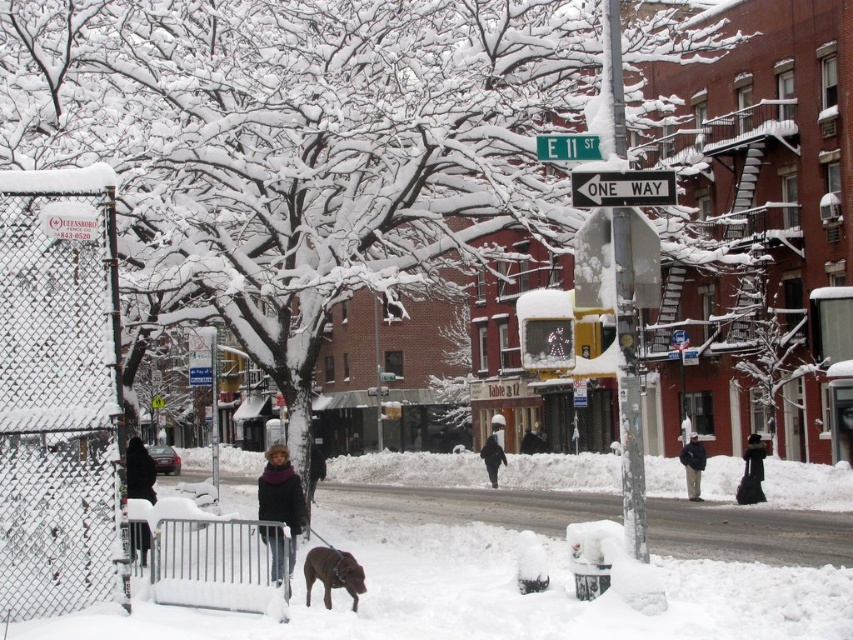
From the picture: Does dark brown leather jacket at center appear over black wool coat at center?

Yes.

Image resolution: width=853 pixels, height=640 pixels. Describe the element at coordinates (281, 497) in the screenshot. I see `dark brown leather jacket at center` at that location.

The image size is (853, 640). In order to click on dark brown leather jacket at center in this screenshot , I will do `click(281, 497)`.

You are a GUI agent. You are given a task and a screenshot of the screen. Output one action in this format:
    pyautogui.click(x=<x>, y=<y>)
    Task: Click on the dark brown leather jacket at center
    Image resolution: width=853 pixels, height=640 pixels.
    Given the screenshot: What is the action you would take?
    pyautogui.click(x=281, y=497)

Is the position of green metallic street sign at upper center less distant than that of black wool coat at center?

Yes, green metallic street sign at upper center is closer to the viewer.

Where is `green metallic street sign at upper center`? Image resolution: width=853 pixels, height=640 pixels. green metallic street sign at upper center is located at coordinates (567, 147).

Which is in front, point (566, 141) or point (498, 417)?

Point (566, 141) is in front.

Where is `green metallic street sign at upper center`? The width and height of the screenshot is (853, 640). green metallic street sign at upper center is located at coordinates (567, 147).

Can you confirm if white chain-link fence at left is thinner than snow-covered metal pole at center?

Yes.

Between point (102, 593) and point (614, 218), which one is positioned in front?

Positioned in front is point (102, 593).

Locate an element on the screen. This screenshot has height=640, width=853. white chain-link fence at left is located at coordinates (59, 394).